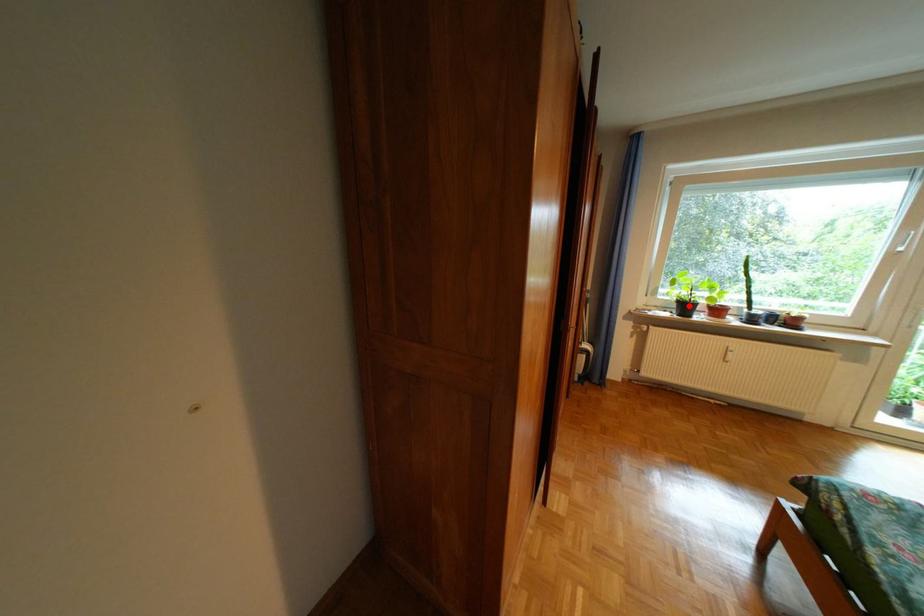
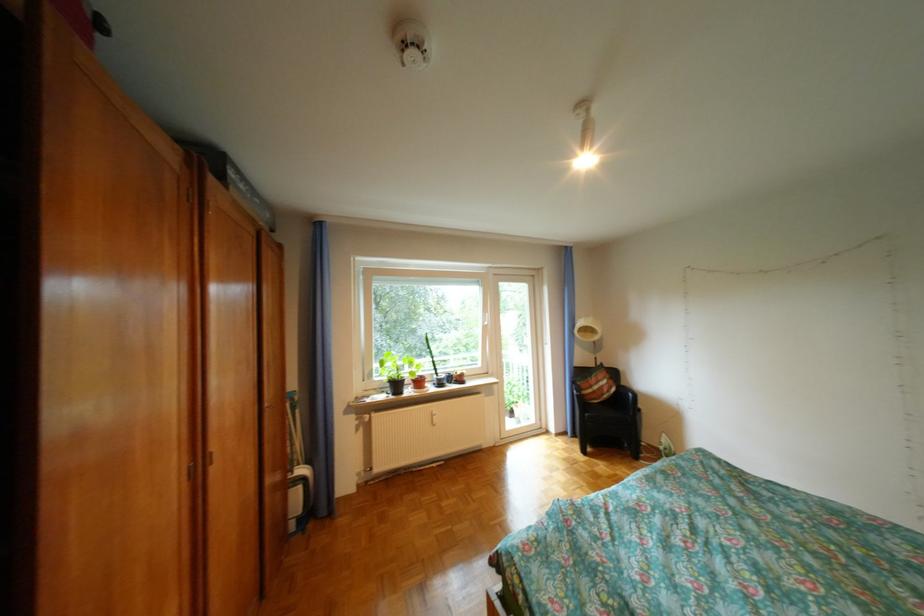
Question: I am providing you with two images of the same scene from different viewpoints. Given a red point in image1, look at the same physical point in image2. Is it:

Choices:
 (A) Closer to the viewpoint
 (B) Farther from the viewpoint

Answer: (B)